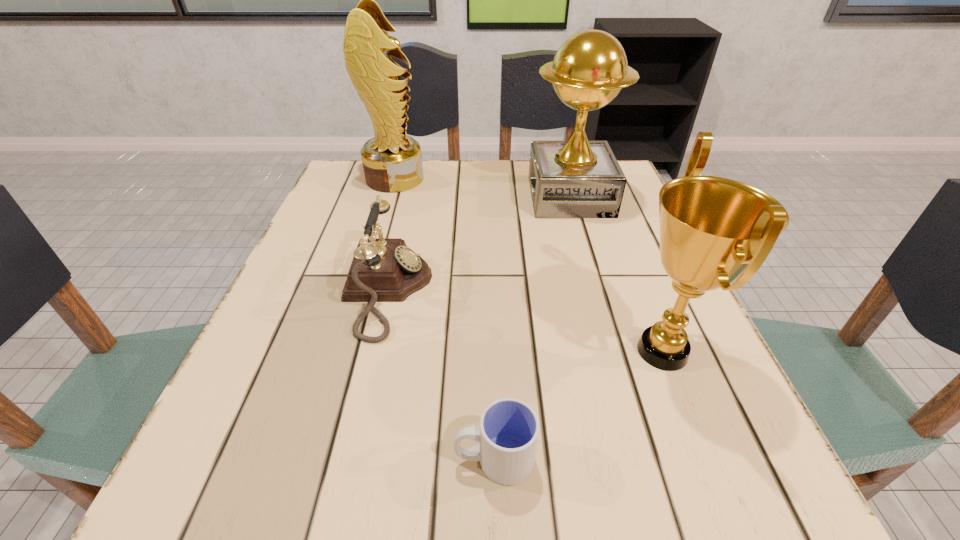
Identify the location of the leftmost award. This screenshot has height=540, width=960. (392, 161).

Where is `the nearest award`? The height and width of the screenshot is (540, 960). the nearest award is located at coordinates (712, 229).

The image size is (960, 540). What are the coordinates of `the fourth tallest object` in the screenshot? It's located at (383, 269).

Locate an element on the screen. The height and width of the screenshot is (540, 960). the third object from left to right is located at coordinates (508, 433).

Locate an element on the screen. This screenshot has height=540, width=960. the nearest object is located at coordinates (508, 433).

I want to click on vacant space located 0.170m on the front-facing side of the leftmost award, so click(x=488, y=179).

I want to click on vacant space located 0.340m on the front view with handles of the nearest award, so click(x=412, y=351).

Identify the location of free point located 0.360m on the front view with handles of the nearest award. (400, 351).

Image resolution: width=960 pixels, height=540 pixels. What are the coordinates of `vacant space located 0.270m on the front view with handles of the nearest award` in the screenshot? It's located at (454, 351).

Image resolution: width=960 pixels, height=540 pixels. I want to click on vacant position located on the dial of the second shortest object, so click(x=609, y=291).